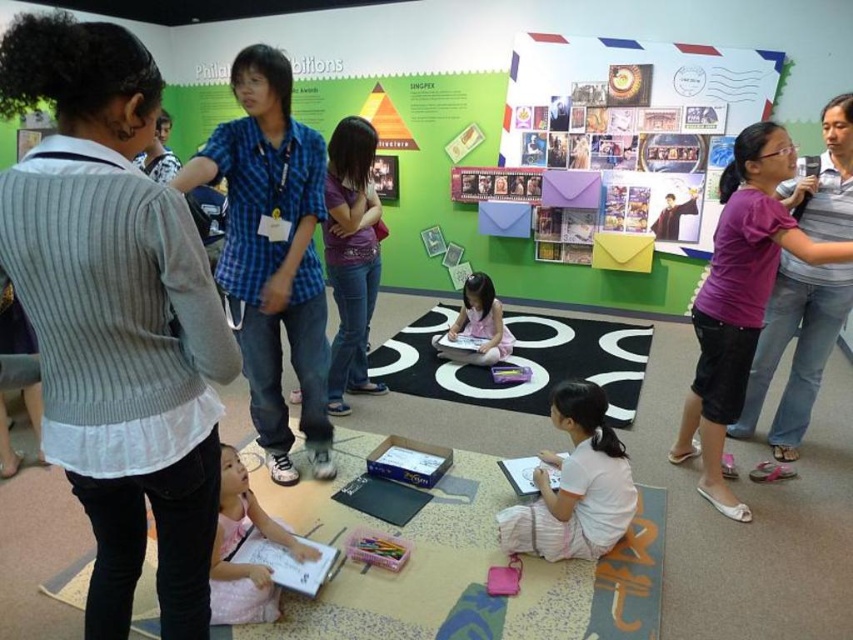
Between blue plaid shirt at center and pink fabric at center, which one appears on the right side from the viewer's perspective?

pink fabric at center

What do you see at coordinates (271, 252) in the screenshot?
I see `blue plaid shirt at center` at bounding box center [271, 252].

Does point (223, 273) come in front of point (477, 296)?

Yes, it is.

The image size is (853, 640). Identify the location of blue plaid shirt at center. (271, 252).

Which is behind, point (751, 118) or point (316, 344)?

Positioned behind is point (751, 118).

Image resolution: width=853 pixels, height=640 pixels. Describe the element at coordinates (636, 116) in the screenshot. I see `multicolored paper at upper right` at that location.

Which is behind, point (556, 45) or point (270, 396)?

The point (556, 45) is behind.

Locate an element on the screen. multicolored paper at upper right is located at coordinates (636, 116).

In the scene shown: Between multicolored paper at upper right and purple cotton shirt at upper right, which one has less height?

Standing shorter between the two is purple cotton shirt at upper right.

Does multicolored paper at upper right have a larger size compared to purple cotton shirt at upper right?

Yes.

This screenshot has width=853, height=640. In order to click on multicolored paper at upper right in this screenshot , I will do [x=636, y=116].